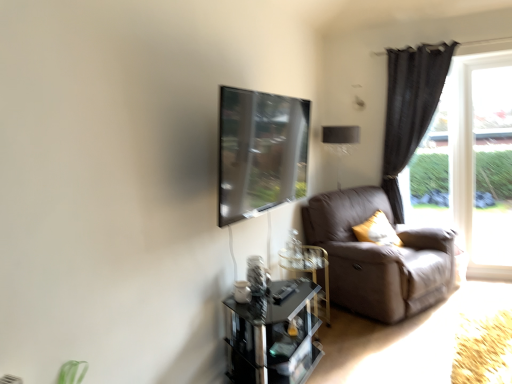
Question: Is transparent glass table at lower center thinner than transparent glass window screen at upper center?

Choices:
 (A) no
 (B) yes

Answer: (A)

Question: Is the position of transparent glass table at lower center more distant than that of transparent glass window screen at upper center?

Choices:
 (A) no
 (B) yes

Answer: (B)

Question: Does transparent glass table at lower center have a greater height compared to transparent glass window screen at upper center?

Choices:
 (A) no
 (B) yes

Answer: (A)

Question: From a real-world perspective, is transparent glass table at lower center under transparent glass window screen at upper center?

Choices:
 (A) no
 (B) yes

Answer: (B)

Question: From a real-world perspective, is transparent glass table at lower center positioned over transparent glass window screen at upper center based on gravity?

Choices:
 (A) no
 (B) yes

Answer: (A)

Question: Visually, is leather at right positioned to the left or to the right of clear glass door at right?

Choices:
 (A) left
 (B) right

Answer: (A)

Question: Do you think leather at right is within clear glass door at right, or outside of it?

Choices:
 (A) inside
 (B) outside

Answer: (B)

Question: In terms of size, does leather at right appear bigger or smaller than clear glass door at right?

Choices:
 (A) big
 (B) small

Answer: (A)

Question: From a real-world perspective, is leather at right positioned above or below clear glass door at right?

Choices:
 (A) below
 (B) above

Answer: (A)

Question: From a real-world perspective, is transparent glass window at right positioned above or below transparent glass table at lower center?

Choices:
 (A) above
 (B) below

Answer: (A)

Question: Looking at the image, does transparent glass window at right seem bigger or smaller compared to transparent glass table at lower center?

Choices:
 (A) big
 (B) small

Answer: (B)

Question: Choose the correct answer: Is transparent glass window at right inside transparent glass table at lower center or outside it?

Choices:
 (A) outside
 (B) inside

Answer: (A)

Question: Is point (510, 230) closer or farther from the camera than point (309, 347)?

Choices:
 (A) closer
 (B) farther

Answer: (B)

Question: From their relative heights in the image, would you say leather at right is taller or shorter than dark gray fabric curtain at right?

Choices:
 (A) tall
 (B) short

Answer: (B)

Question: In terms of width, does leather at right look wider or thinner when compared to dark gray fabric curtain at right?

Choices:
 (A) thin
 (B) wide

Answer: (B)